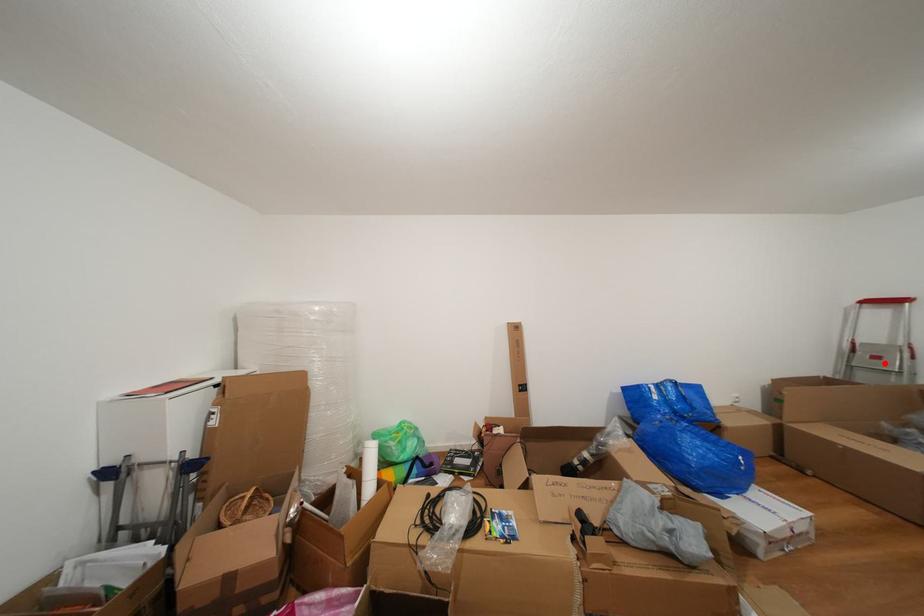
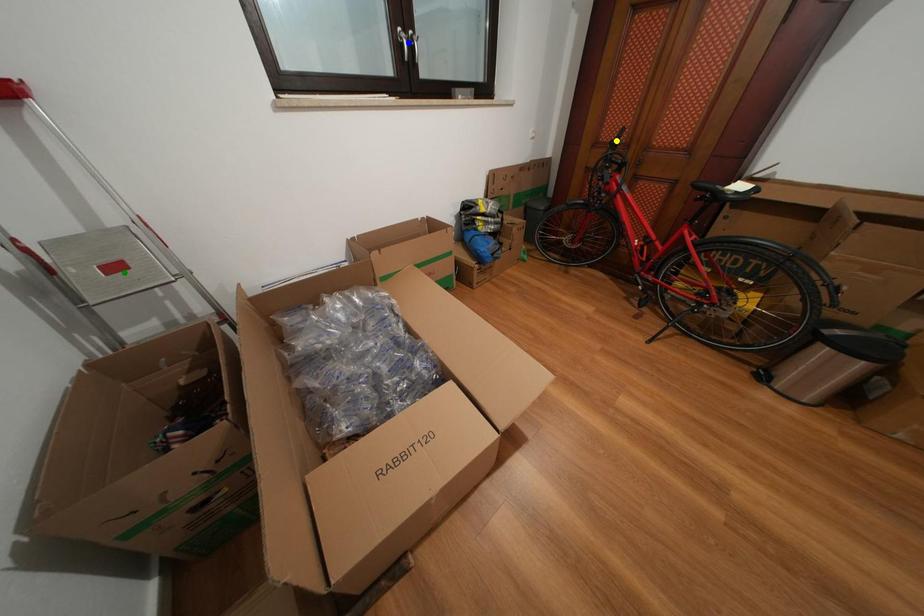
Question: I am providing you with two images of the same scene from different viewpoints. A red point is marked on the first image. You are given multiple points on the second image. Which point in image 2 represents the same 3d spot as the red point in image 1?

Choices:
 (A) green point
 (B) blue point
 (C) yellow point

Answer: (A)